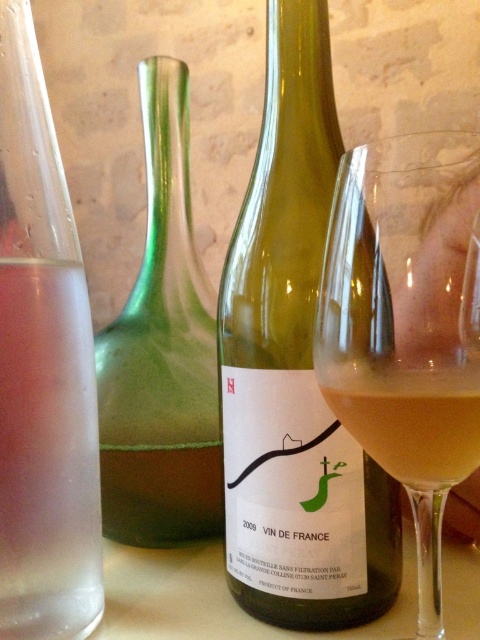
Question: Does green glass wine bottle at center appear over clear glass wine glass at center?

Choices:
 (A) no
 (B) yes

Answer: (B)

Question: Estimate the real-world distances between objects in this image. Which object is closer to the green glass bottle at center?

Choices:
 (A) clear glass wine glass at center
 (B) green glass wine bottle at center
 (C) pale yellow liquid at glass right
 (D) transparent glass at left

Answer: (B)

Question: Which of the following is the closest to the observer?

Choices:
 (A) clear glass wine glass at center
 (B) transparent glass at left

Answer: (A)

Question: Which point is farther to the camera?

Choices:
 (A) green glass bottle at center
 (B) green glass wine bottle at center
 (C) transparent glass at left
 (D) pale yellow liquid at glass right

Answer: (A)

Question: Is green glass wine bottle at center wider than pale yellow liquid at glass right?

Choices:
 (A) no
 (B) yes

Answer: (B)

Question: In this image, where is green glass wine bottle at center located relative to transparent glass at left?

Choices:
 (A) left
 (B) right

Answer: (B)